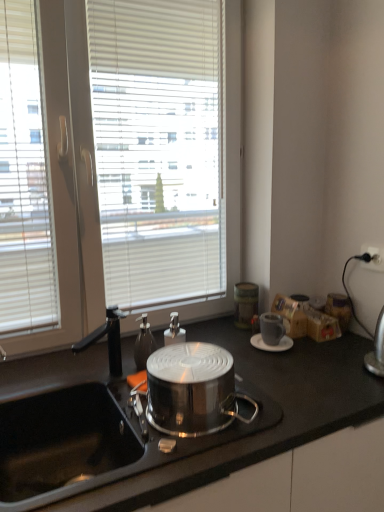
Question: From a real-world perspective, is shiny metallic pot at center physically located above or below black matte countertop at center?

Choices:
 (A) below
 (B) above

Answer: (B)

Question: Do you think shiny metallic pot at center is within black matte countertop at center, or outside of it?

Choices:
 (A) inside
 (B) outside

Answer: (B)

Question: Which is farther from the white plastic power outlet at upper right?

Choices:
 (A) wooden spice rack at right
 (B) white matte saucer at right
 (C) matte gray cup at right
 (D) translucent glass soap dispenser at center
 (E) black matte countertop at center

Answer: (E)

Question: Which of these objects is positioned farthest from the wooden spice rack at right?

Choices:
 (A) black matte countertop at center
 (B) shiny metallic pot at center
 (C) translucent glass soap dispenser at center
 (D) white matte saucer at right
 (E) matte gray cup at right

Answer: (B)